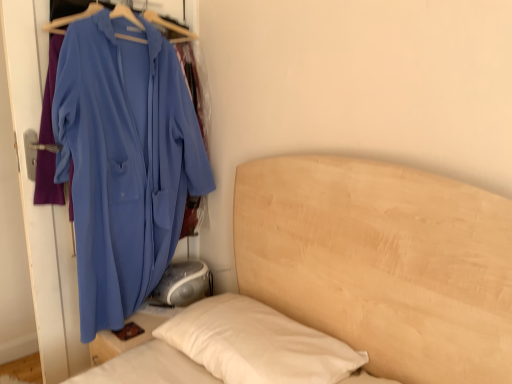
At what (x,y) coordinates should I click in order to perform the action: click on wooden bed at center. Please return your answer as a coordinate pair (x, y). The width and height of the screenshot is (512, 384). Looking at the image, I should click on (381, 262).

What do you see at coordinates (381, 262) in the screenshot? Image resolution: width=512 pixels, height=384 pixels. I see `wooden bed at center` at bounding box center [381, 262].

This screenshot has height=384, width=512. What are the coordinates of `matte blue jacket at left` in the screenshot? It's located at (124, 160).

What do you see at coordinates (124, 160) in the screenshot?
I see `matte blue jacket at left` at bounding box center [124, 160].

Where is `wooden bed at center`? wooden bed at center is located at coordinates (381, 262).

Between wooden bed at center and matte blue jacket at left, which one appears on the left side from the viewer's perspective?

From the viewer's perspective, matte blue jacket at left appears more on the left side.

Based on the photo, is wooden bed at center behind matte blue jacket at left?

No, the depth of wooden bed at center is less than that of matte blue jacket at left.

Considering the points (406, 358) and (153, 101), which point is behind, point (406, 358) or point (153, 101)?

Point (153, 101)

From the image's perspective, is wooden bed at center below matte blue jacket at left?

Yes, from the image's perspective, wooden bed at center is below matte blue jacket at left.

From a real-world perspective, is wooden bed at center on top of matte blue jacket at left?

Actually, wooden bed at center is physically below matte blue jacket at left in the real world.

Consider the image. Looking at their sizes, would you say wooden bed at center is wider or thinner than matte blue jacket at left?

wooden bed at center is wider than matte blue jacket at left.

Is wooden bed at center taller or shorter than matte blue jacket at left?

Clearly, wooden bed at center is shorter compared to matte blue jacket at left.

Considering the relative sizes of wooden bed at center and matte blue jacket at left in the image provided, is wooden bed at center smaller than matte blue jacket at left?

Incorrect, wooden bed at center is not smaller in size than matte blue jacket at left.

Do you think wooden bed at center is within matte blue jacket at left, or outside of it?

wooden bed at center cannot be found inside matte blue jacket at left.

Is wooden bed at center far from matte blue jacket at left?

No, there isn't a large distance between wooden bed at center and matte blue jacket at left.

Is wooden bed at center oriented towards matte blue jacket at left?

No, wooden bed at center is not aimed at matte blue jacket at left.

Looking at this image, can you tell me how much wooden bed at center and matte blue jacket at left differ in facing direction?

The angular difference between wooden bed at center and matte blue jacket at left is 90.4 degrees.

Measure the distance from wooden bed at center to matte blue jacket at left.

27.49 inches.

The width and height of the screenshot is (512, 384). In order to click on jacket behind the wooden bed at center in this screenshot , I will do `click(124, 160)`.

Between matte blue jacket at left and wooden bed at center, which one appears on the left side from the viewer's perspective?

Positioned to the left is matte blue jacket at left.

Considering the relative positions of matte blue jacket at left and wooden bed at center in the image provided, is matte blue jacket at left behind wooden bed at center?

Yes, matte blue jacket at left is behind wooden bed at center.

Between point (126, 30) and point (174, 359), which one is positioned in front?

The point (174, 359) is more forward.

From the image's perspective, between matte blue jacket at left and wooden bed at center, which one is located above?

matte blue jacket at left, from the image's perspective.

From the picture: From a real-world perspective, which is physically above, matte blue jacket at left or wooden bed at center?

matte blue jacket at left, from a real-world perspective.

Based on the photo, between matte blue jacket at left and wooden bed at center, which one has smaller width?

matte blue jacket at left is thinner.

Does matte blue jacket at left have a lesser height compared to wooden bed at center?

In fact, matte blue jacket at left may be taller than wooden bed at center.

Which of these two, matte blue jacket at left or wooden bed at center, is smaller?

matte blue jacket at left is smaller.

Consider the image. Is matte blue jacket at left not within wooden bed at center?

Yes.

Is the surface of matte blue jacket at left in direct contact with wooden bed at center?

No, matte blue jacket at left is not in contact with wooden bed at center.

Is matte blue jacket at left oriented towards wooden bed at center?

Yes.

Where is `jacket behind the wooden bed at center`? The width and height of the screenshot is (512, 384). jacket behind the wooden bed at center is located at coordinates (124, 160).

Image resolution: width=512 pixels, height=384 pixels. What are the coordinates of `jacket above the wooden bed at center (from the image's perspective)` in the screenshot? It's located at (124, 160).

This screenshot has height=384, width=512. I want to click on jacket that is on the left side of wooden bed at center, so click(124, 160).